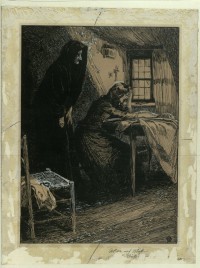
Locate an element on the screen. The height and width of the screenshot is (268, 200). carpet is located at coordinates 119,233.